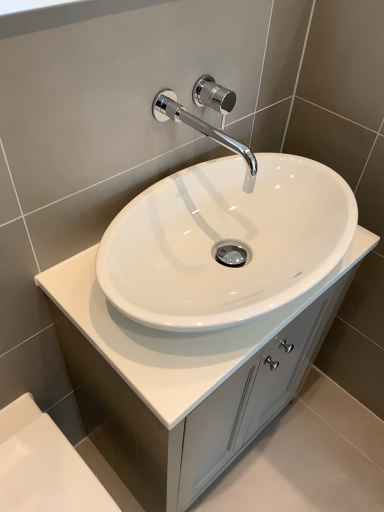
Question: Is polished chrome faucet at upper center aimed at white glossy bath at lower left?

Choices:
 (A) yes
 (B) no

Answer: (B)

Question: Would you say polished chrome faucet at upper center is a long distance from white glossy bath at lower left?

Choices:
 (A) no
 (B) yes

Answer: (A)

Question: Would you say polished chrome faucet at upper center is outside white glossy bath at lower left?

Choices:
 (A) no
 (B) yes

Answer: (B)

Question: Is polished chrome faucet at upper center at the left side of white glossy bath at lower left?

Choices:
 (A) yes
 (B) no

Answer: (B)

Question: Is polished chrome faucet at upper center with white glossy bath at lower left?

Choices:
 (A) yes
 (B) no

Answer: (B)

Question: Is white glossy bath at lower left surrounded by polished chrome faucet at upper center?

Choices:
 (A) no
 (B) yes

Answer: (A)

Question: From a real-world perspective, does white glossy bath at lower left sit lower than chrome/polished metal faucet at upper center?

Choices:
 (A) yes
 (B) no

Answer: (A)

Question: Does white glossy bath at lower left have a greater height compared to chrome/polished metal faucet at upper center?

Choices:
 (A) yes
 (B) no

Answer: (A)

Question: Does white glossy bath at lower left have a lesser width compared to chrome/polished metal faucet at upper center?

Choices:
 (A) no
 (B) yes

Answer: (A)

Question: Is white glossy bath at lower left smaller than chrome/polished metal faucet at upper center?

Choices:
 (A) yes
 (B) no

Answer: (B)

Question: Is white glossy bath at lower left not within chrome/polished metal faucet at upper center?

Choices:
 (A) yes
 (B) no

Answer: (A)

Question: Considering the relative sizes of white glossy bath at lower left and chrome/polished metal faucet at upper center in the image provided, is white glossy bath at lower left bigger than chrome/polished metal faucet at upper center?

Choices:
 (A) no
 (B) yes

Answer: (B)

Question: Considering the relative sizes of polished chrome faucet at upper center and white glossy cabinet at center in the image provided, is polished chrome faucet at upper center thinner than white glossy cabinet at center?

Choices:
 (A) no
 (B) yes

Answer: (B)